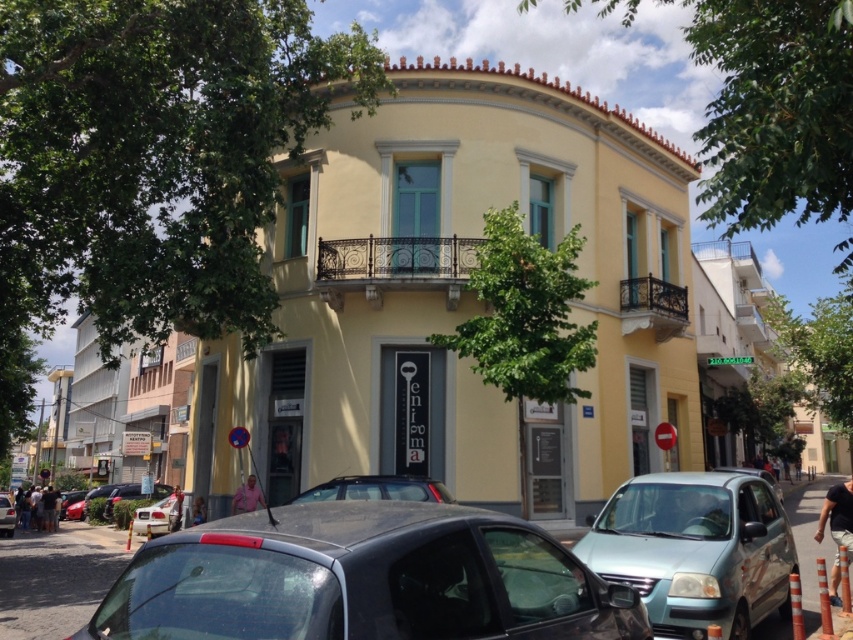
You are a delivery driver who needs to park your matte black car at center in a parking spot located at coordinates 0.764, 0.442. Is the car already positioned correctly?

The matte black car at center is already positioned at point [376,488], so it is correctly parked in the parking spot.

You are a pedestrian standing on the street in front of the cinema building. You see a light blue metallic car at lower right and a silver metallic car at lower left. Which car is positioned higher in the image?

The light blue metallic car at lower right is positioned higher in the image than the silver metallic car at lower left.